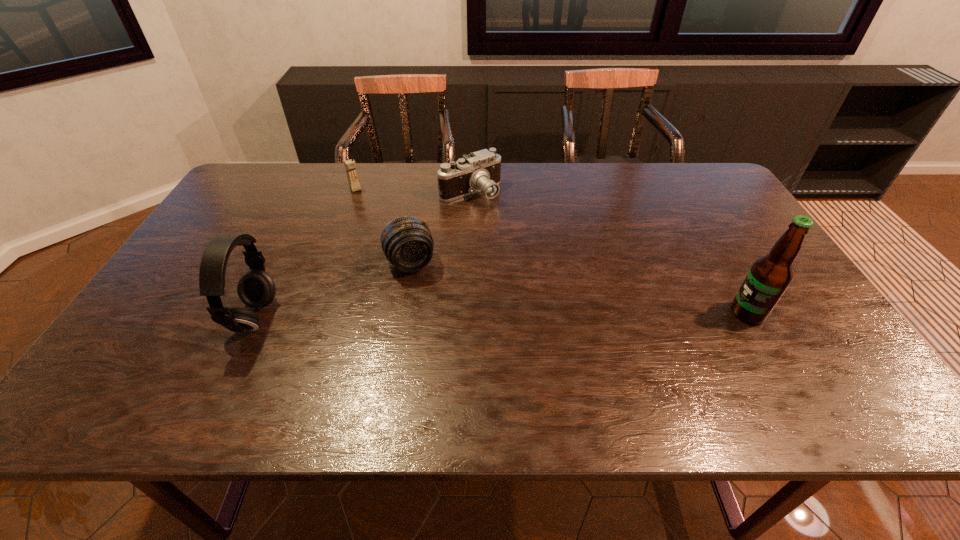
I want to click on vacant space on the desktop that is between the fourth shortest object and the beer bottle and is positioned on the front of the third tallest object, where the keypad is located, so click(443, 315).

Locate an element on the screen. free space on the desktop that is between the earphone and the beer bottle and is positioned at the front element of the third farthest object is located at coordinates (430, 315).

Identify the location of free space on the desktop that is between the earphone and the tallest object and is positioned at the lens of the camera. The image size is (960, 540). (562, 314).